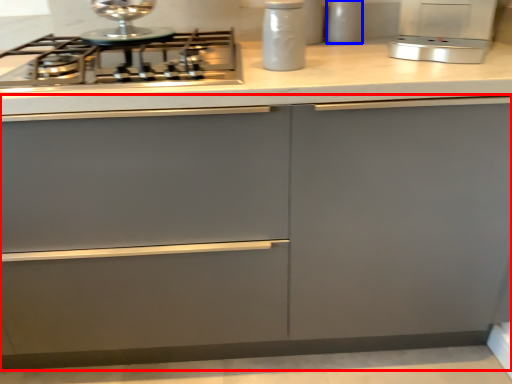
Question: Which of the following is the farthest to the observer, cabinetry (highlighted by a red box) or kitchen appliance (highlighted by a blue box)?

Choices:
 (A) cabinetry
 (B) kitchen appliance

Answer: (B)